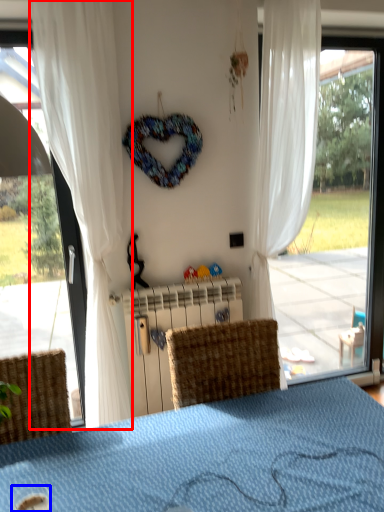
Question: Among these objects, which one is farthest to the camera, curtain (highlighted by a red box) or beverage (highlighted by a blue box)?

Choices:
 (A) curtain
 (B) beverage

Answer: (A)